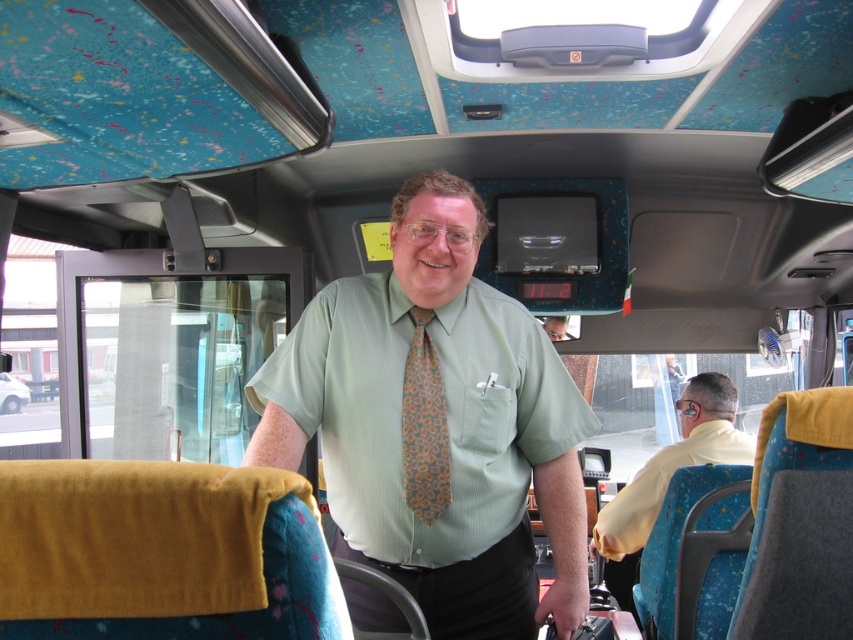
Is green textured shirt at center further to camera compared to yellow shirt at right?

No.

This screenshot has height=640, width=853. What do you see at coordinates (436, 426) in the screenshot?
I see `green textured shirt at center` at bounding box center [436, 426].

At what (x,y) coordinates should I click in order to perform the action: click on green textured shirt at center. Please return your answer as a coordinate pair (x, y). Looking at the image, I should click on (436, 426).

Does green textured shirt at center lie behind orange patterned tie at center?

That is False.

Who is positioned more to the left, green textured shirt at center or orange patterned tie at center?

Positioned to the left is orange patterned tie at center.

Who is more distant from viewer, (440, 282) or (404, 451)?

Point (440, 282)

Locate an element on the screen. Image resolution: width=853 pixels, height=640 pixels. green textured shirt at center is located at coordinates (436, 426).

Between yellow shirt at right and orange patterned tie at center, which one appears on the left side from the viewer's perspective?

From the viewer's perspective, orange patterned tie at center appears more on the left side.

Who is positioned more to the right, yellow shirt at right or orange patterned tie at center?

yellow shirt at right

Between point (650, 516) and point (410, 433), which one is positioned behind?

The point (650, 516) is behind.

Find the location of a particular element. yellow shirt at right is located at coordinates (674, 464).